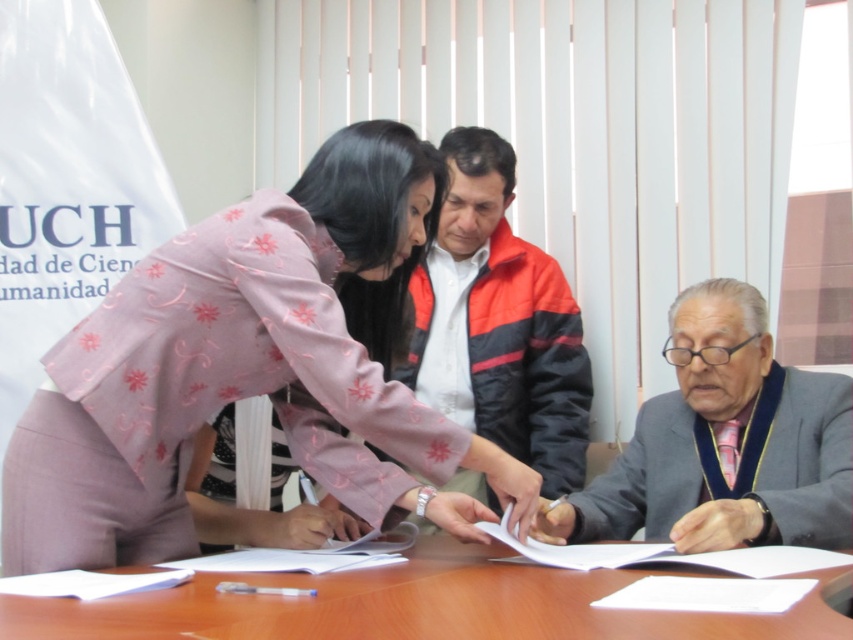
Is pink floral fabric at center behind wooden table at center?

Yes, it is.

Between point (428, 490) and point (640, 576), which one is positioned in front?

Point (640, 576) is more forward.

Locate an element on the screen. The height and width of the screenshot is (640, 853). pink floral fabric at center is located at coordinates (248, 368).

Is point (96, 524) positioned before point (659, 509)?

Yes, it is in front of point (659, 509).

Does pink floral fabric at center appear over gray wool suit at lower right?

Indeed, pink floral fabric at center is positioned over gray wool suit at lower right.

Locate an element on the screen. This screenshot has height=640, width=853. pink floral fabric at center is located at coordinates (248, 368).

Does gray wool suit at lower right have a lesser height compared to wooden table at center?

No, gray wool suit at lower right is not shorter than wooden table at center.

Can you confirm if gray wool suit at lower right is bigger than wooden table at center?

Yes.

What do you see at coordinates (724, 444) in the screenshot? I see `gray wool suit at lower right` at bounding box center [724, 444].

You are a GUI agent. You are given a task and a screenshot of the screen. Output one action in this format:
    pyautogui.click(x=<x>, y=<y>)
    Task: Click on the gray wool suit at lower right
    This screenshot has width=853, height=640.
    Given the screenshot: What is the action you would take?
    pyautogui.click(x=724, y=444)